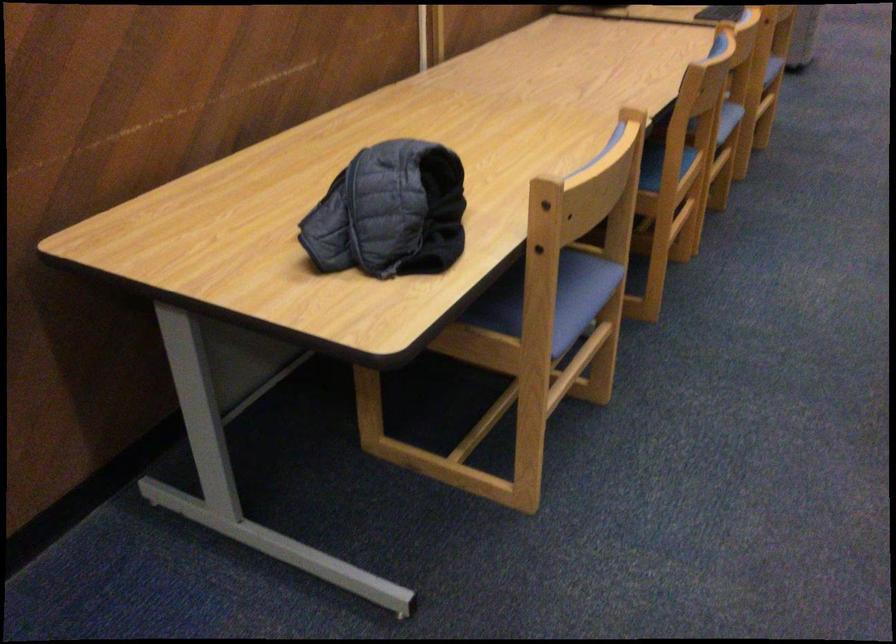
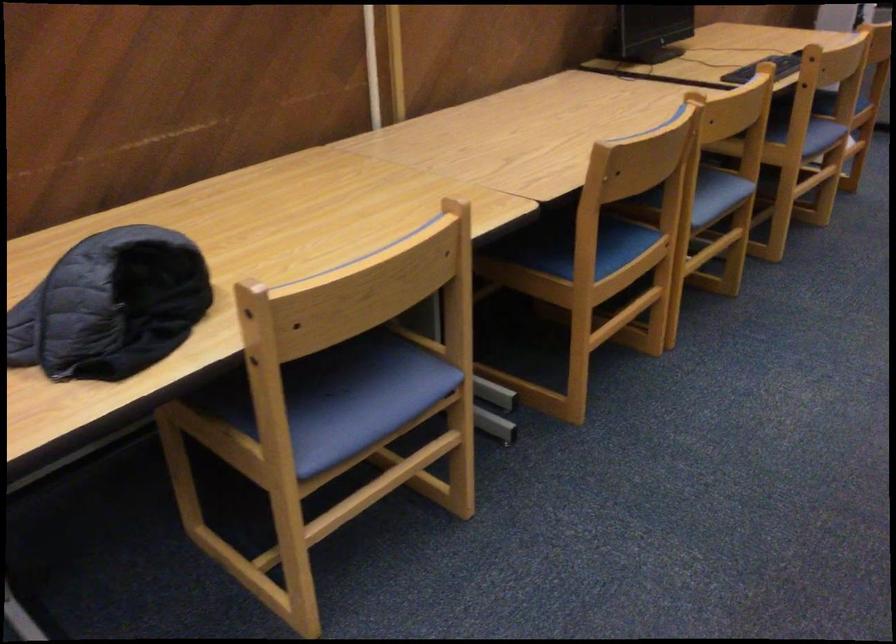
Find the pixel in the second image that matches (x=719, y=120) in the first image.

(718, 194)